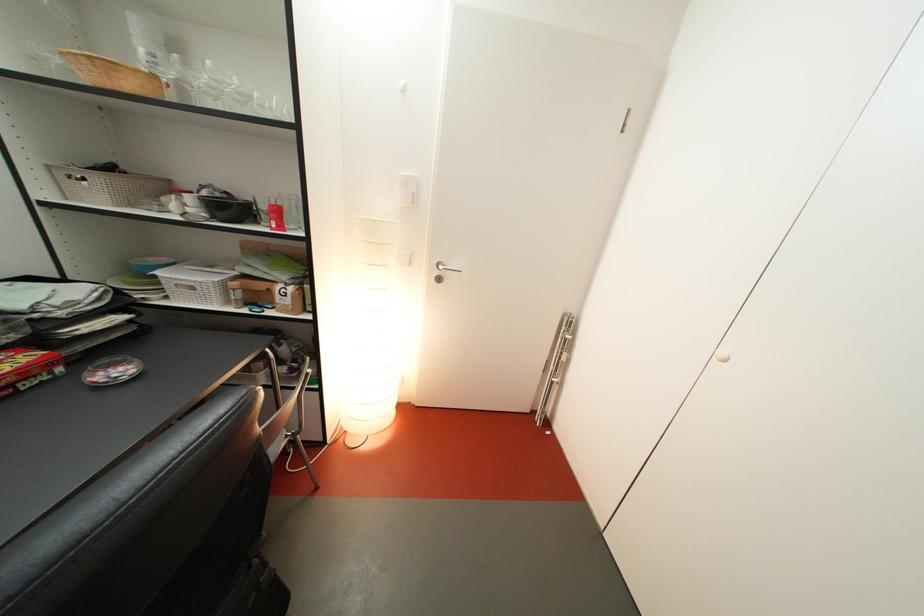
What do you see at coordinates (150, 264) in the screenshot?
I see `the light blue bowl` at bounding box center [150, 264].